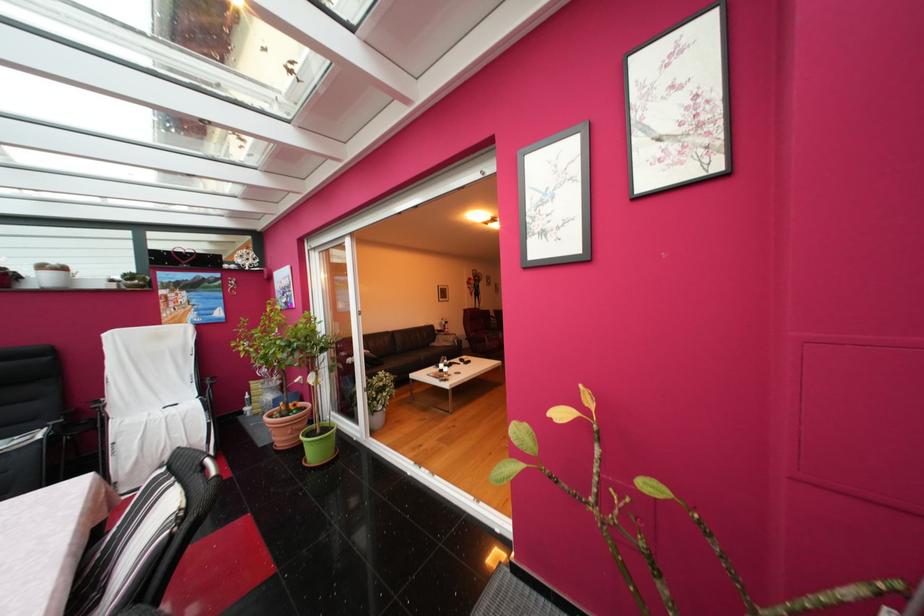
In order to click on black chair armrest in this screenshot , I will do `click(61, 424)`.